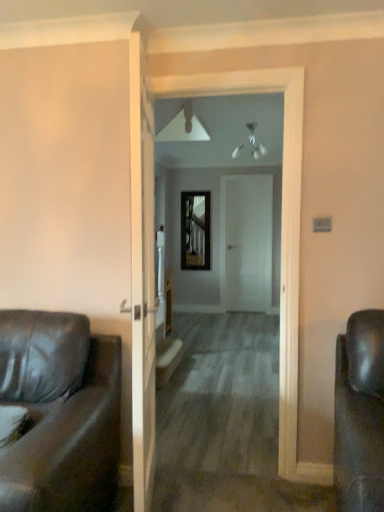
Question: Does wooden at center have a larger size compared to smooth wooden floor at center?

Choices:
 (A) no
 (B) yes

Answer: (A)

Question: Are wooden at center and smooth wooden floor at center far apart?

Choices:
 (A) no
 (B) yes

Answer: (B)

Question: Is wooden at center aimed at smooth wooden floor at center?

Choices:
 (A) no
 (B) yes

Answer: (A)

Question: Is wooden at center positioned in front of smooth wooden floor at center?

Choices:
 (A) no
 (B) yes

Answer: (A)

Question: From a real-world perspective, does wooden at center stand above smooth wooden floor at center?

Choices:
 (A) yes
 (B) no

Answer: (B)

Question: Does wooden at center have a lesser height compared to smooth wooden floor at center?

Choices:
 (A) no
 (B) yes

Answer: (B)

Question: Is matte black leather couch at left positioned before wooden at center?

Choices:
 (A) no
 (B) yes

Answer: (B)

Question: Could you tell me if matte black leather couch at left is turned towards wooden at center?

Choices:
 (A) no
 (B) yes

Answer: (A)

Question: Is matte black leather couch at left not close to wooden at center?

Choices:
 (A) yes
 (B) no

Answer: (A)

Question: Is the surface of matte black leather couch at left in direct contact with wooden at center?

Choices:
 (A) yes
 (B) no

Answer: (B)

Question: Is matte black leather couch at left not inside wooden at center?

Choices:
 (A) yes
 (B) no

Answer: (A)

Question: Would you say wooden at center is part of matte black leather couch at left's contents?

Choices:
 (A) no
 (B) yes

Answer: (A)

Question: Would you consider white matte door at center to be distant from smooth wooden floor at center?

Choices:
 (A) no
 (B) yes

Answer: (B)